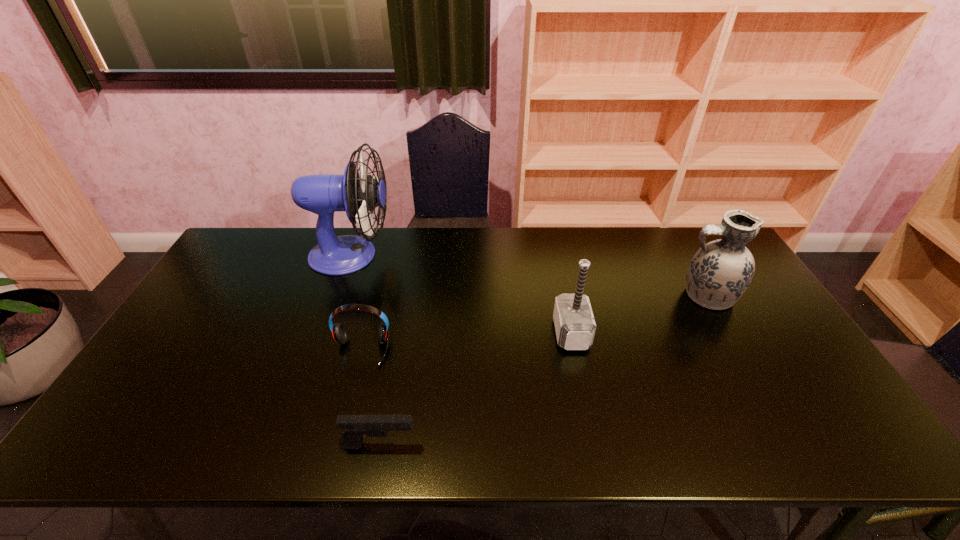
Locate an element on the screen. Image resolution: width=960 pixels, height=540 pixels. fan is located at coordinates (359, 196).

Find the location of a particular element. vase is located at coordinates (719, 273).

Identify the location of hammer. (575, 326).

The height and width of the screenshot is (540, 960). What are the coordinates of `the fourth tallest object` in the screenshot? It's located at (339, 332).

The image size is (960, 540). I want to click on the shortest object, so click(356, 427).

In order to click on the nearest object in this screenshot , I will do (356, 427).

Find the location of a particular element. The width and height of the screenshot is (960, 540). vacant area situated 0.050m in front of the tallest object where the airflow is directed is located at coordinates (408, 255).

The width and height of the screenshot is (960, 540). Find the location of `vacant space located with the handle on the side of the rightmost object`. vacant space located with the handle on the side of the rightmost object is located at coordinates (x=602, y=296).

Image resolution: width=960 pixels, height=540 pixels. What are the coordinates of `vacant space located with the handle on the side of the rightmost object` in the screenshot? It's located at (569, 296).

I want to click on free space located 0.340m with the handle on the side of the rightmost object, so (x=566, y=296).